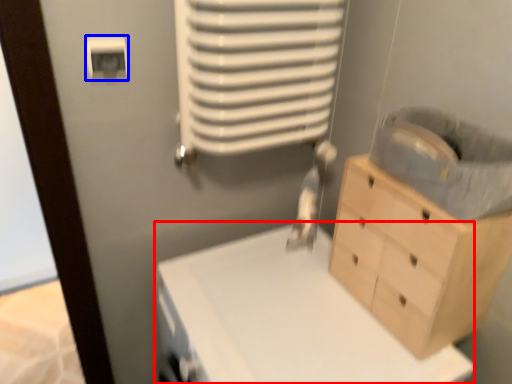
Question: Which object is closer to the camera taking this photo, changing table (highlighted by a red box) or light switch (highlighted by a blue box)?

Choices:
 (A) changing table
 (B) light switch

Answer: (A)